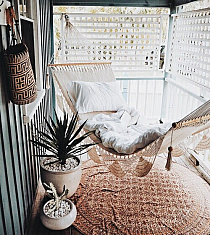
In order to click on blanket in this screenshot , I will do `click(128, 141)`.